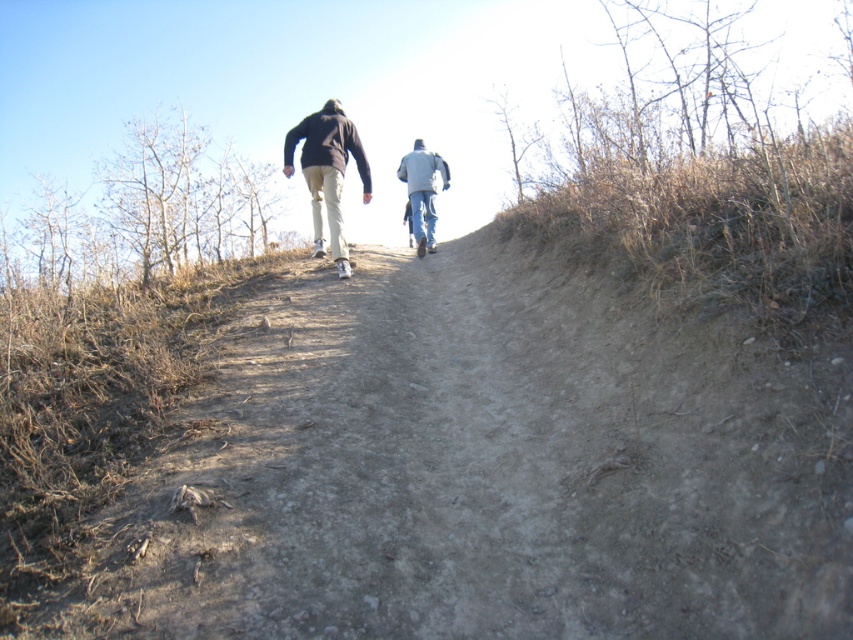
You are planning to walk along the dull gray dirt track at center while wearing the light blue jeans at center. Do you think the path is wide enough for you to walk comfortably without stepping off the track?

The dull gray dirt track at center might be wider than light blue jeans at center, so it is possible that the path is wide enough for comfortable walking without stepping off.

Consider the image. You are standing at the bottom of the hill and see the dull gray dirt track at center and the dark brown hoodie at center. Which object is positioned to the right side from your perspective?

The dull gray dirt track at center is to the right of dark brown hoodie at center, so the dull gray dirt track at center is positioned to the right side from your perspective.

You are planning to walk along the dull gray dirt track at center while wearing the dark brown hoodie at center. Considering the distance between them, will you need to adjust your position to ensure the hoodie doesn not interfere with your movement on the track?

The dull gray dirt track at center is 7.41 feet from the dark brown hoodie at center. Since the hoodie is on your body, its position relative to the track won not interfere with your movement as you walk along the track.